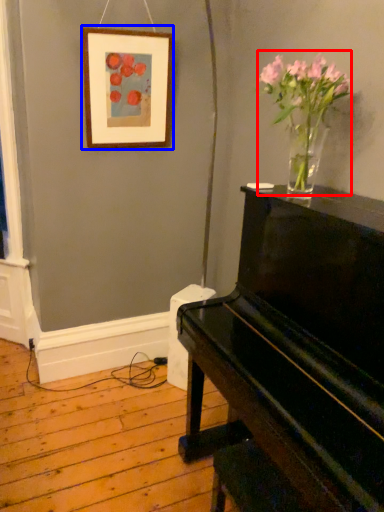
Question: Which object appears farthest to the camera in this image, floral arrangement (highlighted by a red box) or picture frame (highlighted by a blue box)?

Choices:
 (A) floral arrangement
 (B) picture frame

Answer: (B)